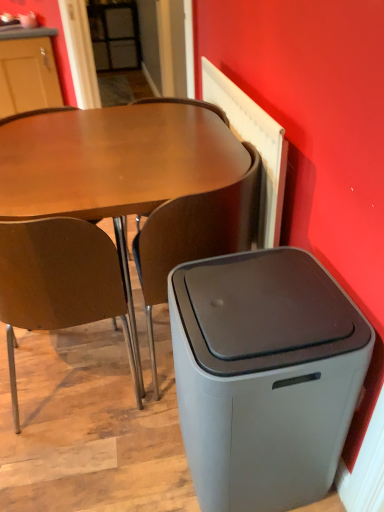
Question: Should I look upward or downward to see gray matte trash bin/can at lower right?

Choices:
 (A) down
 (B) up

Answer: (A)

Question: Is brown wood chair at left, positioned as the first chair in left-to-right order, bigger than gray matte trash bin/can at lower right?

Choices:
 (A) no
 (B) yes

Answer: (B)

Question: Could you tell me if brown wood chair at left, positioned as the first chair in left-to-right order, is facing gray matte trash bin/can at lower right?

Choices:
 (A) no
 (B) yes

Answer: (A)

Question: Is brown wood chair at left, which is the second chair in right-to-left order, oriented away from gray matte trash bin/can at lower right?

Choices:
 (A) yes
 (B) no

Answer: (B)

Question: Is brown wood chair at left, positioned as the first chair in left-to-right order, further to camera compared to gray matte trash bin/can at lower right?

Choices:
 (A) yes
 (B) no

Answer: (A)

Question: From a real-world perspective, is brown wood chair at left, positioned as the first chair in left-to-right order, located beneath gray matte trash bin/can at lower right?

Choices:
 (A) no
 (B) yes

Answer: (A)

Question: From the image's perspective, is brown wood chair at left, which is the second chair in right-to-left order, located beneath gray matte trash bin/can at lower right?

Choices:
 (A) yes
 (B) no

Answer: (B)

Question: Considering the relative positions of gray matte trash bin/can at lower right and brown matte chair at center, which is counted as the 2th chair, starting from the left, in the image provided, is gray matte trash bin/can at lower right in front of brown matte chair at center, which is counted as the 2th chair, starting from the left,?

Choices:
 (A) no
 (B) yes

Answer: (B)

Question: Is gray matte trash bin/can at lower right shorter than brown matte chair at center, which is counted as the 2th chair, starting from the left?

Choices:
 (A) yes
 (B) no

Answer: (A)

Question: Can you confirm if gray matte trash bin/can at lower right is positioned to the right of brown matte chair at center, which is counted as the 2th chair, starting from the left?

Choices:
 (A) no
 (B) yes

Answer: (B)

Question: Is gray matte trash bin/can at lower right smaller than brown matte chair at center, which is counted as the 2th chair, starting from the left?

Choices:
 (A) yes
 (B) no

Answer: (A)

Question: Are gray matte trash bin/can at lower right and brown matte chair at center, the first chair positioned from the right, located far from each other?

Choices:
 (A) yes
 (B) no

Answer: (B)

Question: Considering the relative sizes of gray matte trash bin/can at lower right and brown matte chair at center, which is counted as the 2th chair, starting from the left, in the image provided, is gray matte trash bin/can at lower right taller than brown matte chair at center, which is counted as the 2th chair, starting from the left,?

Choices:
 (A) no
 (B) yes

Answer: (A)

Question: Considering the relative sizes of matte brown desk at center and brown matte chair at center, which is counted as the 2th chair, starting from the left, in the image provided, is matte brown desk at center thinner than brown matte chair at center, which is counted as the 2th chair, starting from the left,?

Choices:
 (A) no
 (B) yes

Answer: (A)